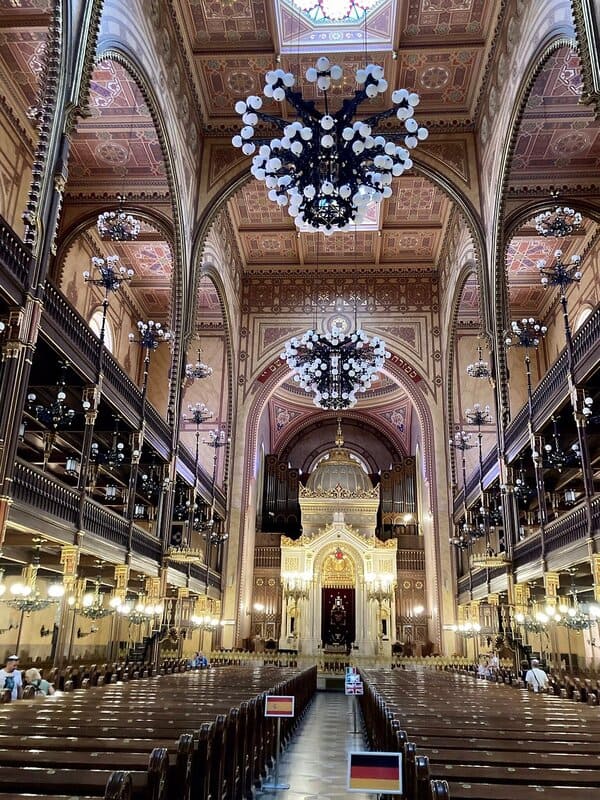
Image resolution: width=600 pixels, height=800 pixels. In order to click on lights that are currently on in this screenshot , I will do `click(31, 598)`, `click(83, 598)`, `click(142, 613)`, `click(207, 618)`, `click(466, 626)`, `click(547, 621)`, `click(581, 621)`, `click(293, 588)`, `click(383, 582)`.